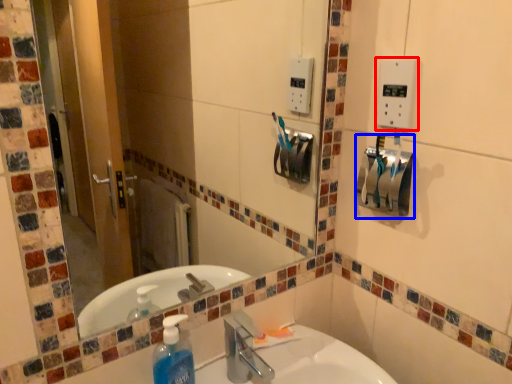
Question: Which object is further to the camera taking this photo, light switch (highlighted by a red box) or hand dryer (highlighted by a blue box)?

Choices:
 (A) light switch
 (B) hand dryer

Answer: (B)